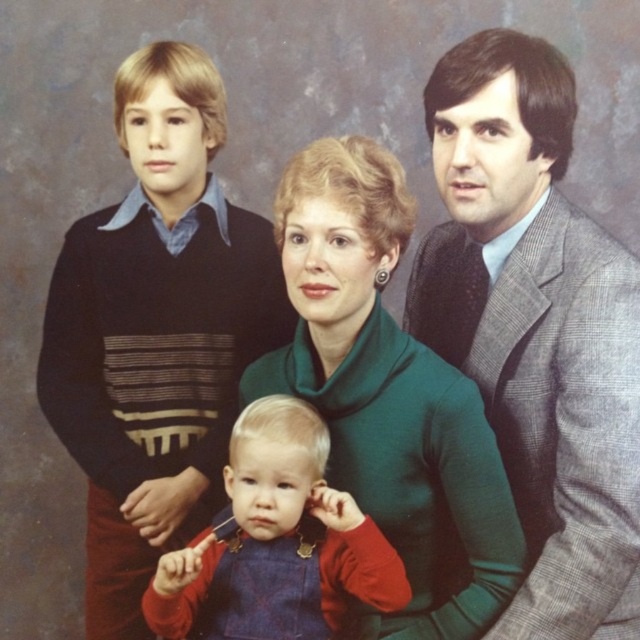
Question: Does gray textured suit at right appear over red velvet overalls at center?

Choices:
 (A) no
 (B) yes

Answer: (B)

Question: Which point is closer to the camera?

Choices:
 (A) gray textured suit at right
 (B) red velvet overalls at center

Answer: (B)

Question: Does gray textured suit at right come behind red velvet overalls at center?

Choices:
 (A) no
 (B) yes

Answer: (B)

Question: Among these points, which one is nearest to the camera?

Choices:
 (A) (500, 81)
 (B) (456, 401)
 (C) (285, 480)

Answer: (A)

Question: Which object appears farthest from the camera in this image?

Choices:
 (A) green woolen sweater at center
 (B) gray textured suit at right
 (C) red velvet overalls at center

Answer: (A)

Question: Does gray textured suit at right have a greater width compared to red velvet overalls at center?

Choices:
 (A) no
 (B) yes

Answer: (A)